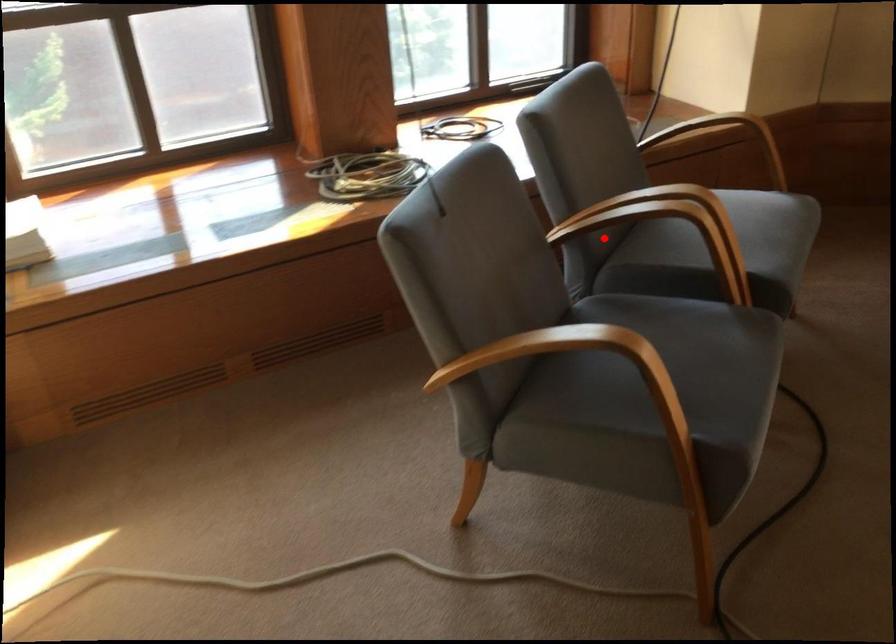
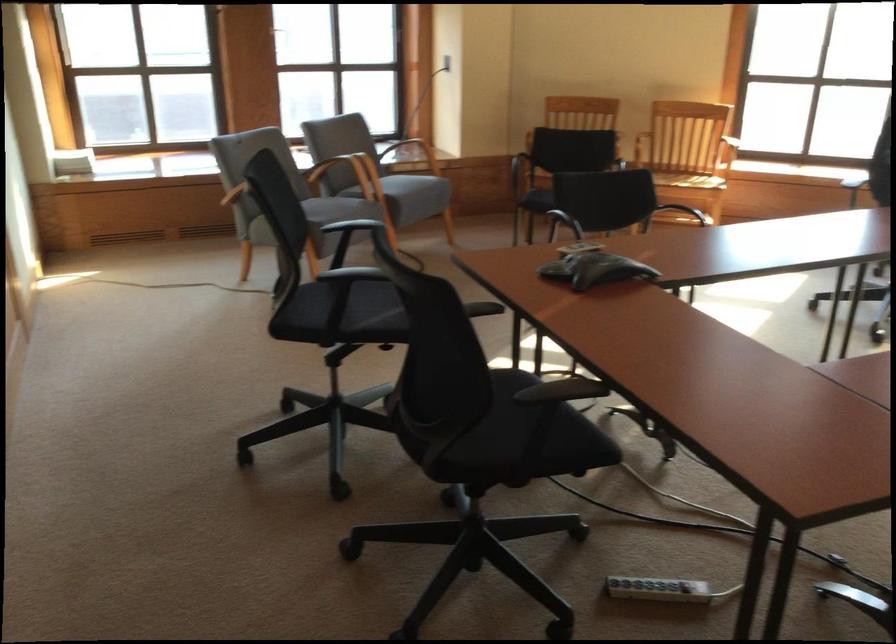
Locate, in the second image, the point that corresponds to the highlighted location in the first image.

(342, 172)